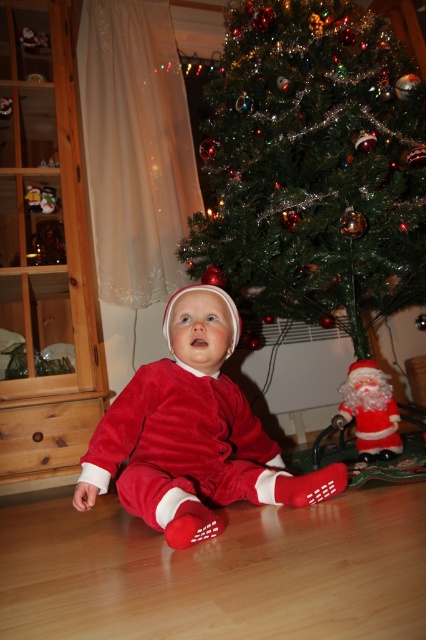
You are standing at the point marked as point (313, 164). Which object are you closest to?

The point (313, 164) corresponds to the green shiny christmas tree at center, so you are closest to the green shiny christmas tree at center.

You are a photographer planning to take a photo of the green shiny christmas tree at center and the velvet red santa suit at center. You want to ensure both are fully visible in the frame. Which object requires a wider angle to capture its full width?

The green shiny christmas tree at center requires a wider angle to capture its full width because its width is larger than the velvet red santa suit at center.